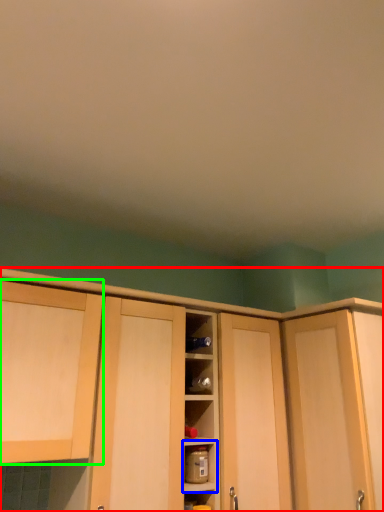
Question: Considering the real-world distances, which object is farthest from cabinetry (highlighted by a red box)? shelf (highlighted by a blue box) or cabinetry (highlighted by a green box)?

Choices:
 (A) shelf
 (B) cabinetry

Answer: (A)